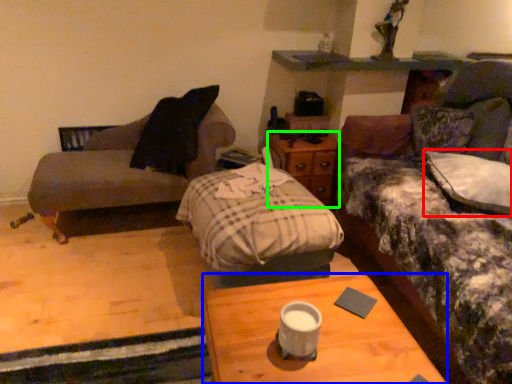
Question: Considering the real-world distances, which object is closest to pillow (highlighted by a red box)? desk (highlighted by a blue box) or nightstand (highlighted by a green box).

Choices:
 (A) desk
 (B) nightstand

Answer: (B)